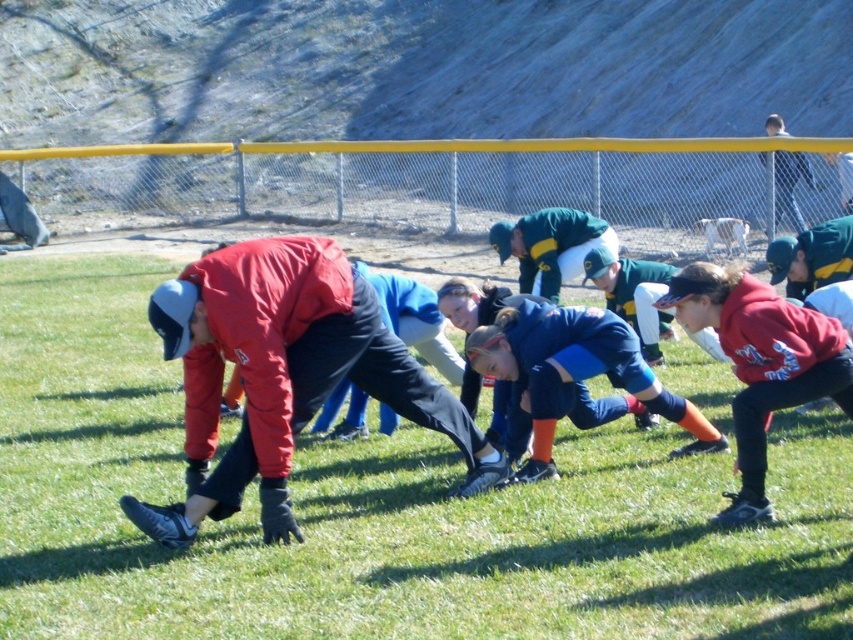
You are standing at the origin of a coordinate system placed at the bottom left corner of the image. The point with coordinates point (283, 374) is marked on the image. Which object is this point located on?

The point (283, 374) is located on the matte red jacket at center.

You are a photographer standing at the edge of the field where the group is exercising. You want to take a photo that includes both the point at coordinates point (686, 531) and point (753, 451). Which point should you focus on first to ensure both are in sharp focus?

You should focus on point (686, 531) first because it is closer to the camera than point (753, 451), ensuring both points are within the depth of field.

You are a photographer positioned behind the group of individuals on the grassy field. You want to capture a shot where the green grass at center is visible above the matte red jacket at center. Is this possible based on the current arrangement?

Yes, the green grass at center is already positioned above the matte red jacket at center, so capturing such a shot is possible.